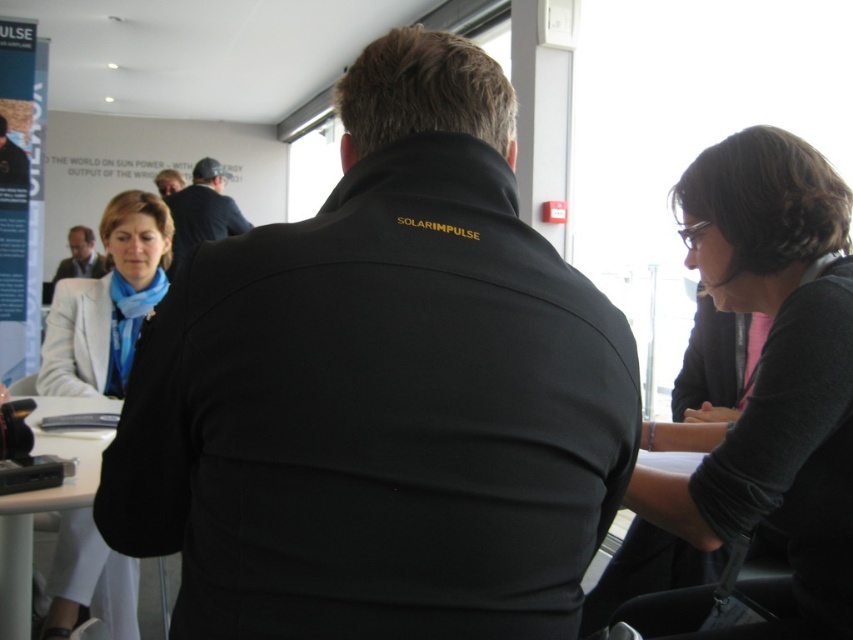
Between point (410, 42) and point (171, 182), which one is positioned behind?

The point (171, 182) is more distant.

Is black softshell jacket at center taller than matte black jacket at center?

Correct, black softshell jacket at center is much taller as matte black jacket at center.

Between point (242, 259) and point (170, 186), which one is positioned behind?

Positioned behind is point (170, 186).

The image size is (853, 640). Find the location of `black softshell jacket at center`. black softshell jacket at center is located at coordinates (381, 392).

Looking at this image, who is shorter, matte black laptop at left or matte black jacket at center?

Standing shorter between the two is matte black jacket at center.

From the picture: Does matte black laptop at left have a larger size compared to matte black jacket at center?

Correct, matte black laptop at left is larger in size than matte black jacket at center.

Identify the location of matte black laptop at left. The height and width of the screenshot is (640, 853). (80, 257).

Is point (293, 580) farther from viewer compared to point (225, 234)?

No, it is not.

Who is taller, black softshell jacket at center or dark blue shirt at center?

Standing taller between the two is dark blue shirt at center.

Which is behind, point (352, 426) or point (196, 164)?

Point (196, 164)

This screenshot has width=853, height=640. Find the location of `black softshell jacket at center`. black softshell jacket at center is located at coordinates (381, 392).